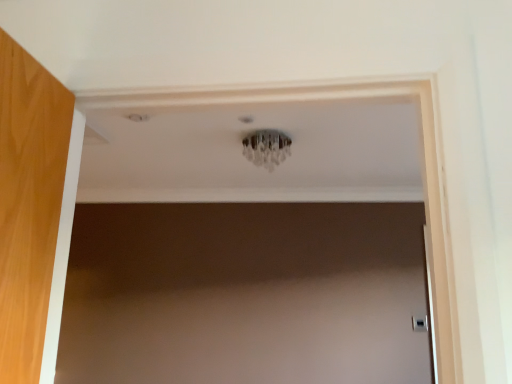
I want to click on satin silver door handle at lower right, so click(x=420, y=323).

What do you see at coordinates (420, 323) in the screenshot?
I see `satin silver door handle at lower right` at bounding box center [420, 323].

The width and height of the screenshot is (512, 384). Describe the element at coordinates (266, 148) in the screenshot. I see `clear crystal chandelier at center` at that location.

Where is `clear crystal chandelier at center`? The height and width of the screenshot is (384, 512). clear crystal chandelier at center is located at coordinates (266, 148).

Identify the location of satin silver door handle at lower right. (420, 323).

Based on their positions, is clear crystal chandelier at center located to the left or right of satin silver door handle at lower right?

From the image, it's evident that clear crystal chandelier at center is to the left of satin silver door handle at lower right.

Is the position of clear crystal chandelier at center more distant than that of satin silver door handle at lower right?

That is False.

Is point (263, 133) positioned in front of point (422, 330)?

Yes.

From the image's perspective, is clear crystal chandelier at center above or below satin silver door handle at lower right?

Clearly, from the image's perspective, clear crystal chandelier at center is above satin silver door handle at lower right.

Based on the photo, from a real-world perspective, who is located lower, clear crystal chandelier at center or satin silver door handle at lower right?

From a 3D spatial view, satin silver door handle at lower right is below.

Considering the sizes of objects clear crystal chandelier at center and satin silver door handle at lower right in the image provided, who is wider, clear crystal chandelier at center or satin silver door handle at lower right?

clear crystal chandelier at center is wider.

From their relative heights in the image, would you say clear crystal chandelier at center is taller or shorter than satin silver door handle at lower right?

Clearly, clear crystal chandelier at center is taller compared to satin silver door handle at lower right.

In the scene shown: Considering the sizes of objects clear crystal chandelier at center and satin silver door handle at lower right in the image provided, who is bigger, clear crystal chandelier at center or satin silver door handle at lower right?

clear crystal chandelier at center is bigger.

Is clear crystal chandelier at center inside the boundaries of satin silver door handle at lower right, or outside?

clear crystal chandelier at center is spatially situated outside satin silver door handle at lower right.

Are clear crystal chandelier at center and satin silver door handle at lower right far apart?

Yes, clear crystal chandelier at center and satin silver door handle at lower right are located far from each other.

Is clear crystal chandelier at center looking in the opposite direction of satin silver door handle at lower right?

No.

Where is `light fixture located in front of the satin silver door handle at lower right`? The image size is (512, 384). light fixture located in front of the satin silver door handle at lower right is located at coordinates (266, 148).

From the picture: Between satin silver door handle at lower right and clear crystal chandelier at center, which one appears on the left side from the viewer's perspective?

clear crystal chandelier at center is more to the left.

Considering the positions of objects satin silver door handle at lower right and clear crystal chandelier at center in the image provided, who is in front, satin silver door handle at lower right or clear crystal chandelier at center?

clear crystal chandelier at center is in front.

Which point is more forward, (420, 330) or (254, 148)?

The point (254, 148) is closer.

From the image's perspective, which one is positioned lower, satin silver door handle at lower right or clear crystal chandelier at center?

satin silver door handle at lower right, from the image's perspective.

From a real-world perspective, between satin silver door handle at lower right and clear crystal chandelier at center, who is vertically higher?

In real-world perspective, clear crystal chandelier at center is above.

Is satin silver door handle at lower right wider or thinner than clear crystal chandelier at center?

In the image, satin silver door handle at lower right appears to be more narrow than clear crystal chandelier at center.

From the picture: Is satin silver door handle at lower right taller than clear crystal chandelier at center?

In fact, satin silver door handle at lower right may be shorter than clear crystal chandelier at center.

Based on their sizes in the image, would you say satin silver door handle at lower right is bigger or smaller than clear crystal chandelier at center?

satin silver door handle at lower right is smaller than clear crystal chandelier at center.

Is clear crystal chandelier at center a part of satin silver door handle at lower right?

No, clear crystal chandelier at center is not surrounded by satin silver door handle at lower right.

Is satin silver door handle at lower right directly adjacent to clear crystal chandelier at center?

satin silver door handle at lower right and clear crystal chandelier at center are not in contact.

Is satin silver door handle at lower right oriented away from clear crystal chandelier at center?

No.

How different are the orientations of satin silver door handle at lower right and clear crystal chandelier at center in degrees?

satin silver door handle at lower right and clear crystal chandelier at center are facing 1.74 degrees away from each other.

This screenshot has height=384, width=512. Find the location of `light fixture above the satin silver door handle at lower right (from the image's perspective)`. light fixture above the satin silver door handle at lower right (from the image's perspective) is located at coordinates (266, 148).

You are a GUI agent. You are given a task and a screenshot of the screen. Output one action in this format:
    pyautogui.click(x=<x>, y=<y>)
    Task: Click on the door handle that appears below the clear crystal chandelier at center (from the image's perspective)
    The image size is (512, 384).
    Given the screenshot: What is the action you would take?
    pyautogui.click(x=420, y=323)

In the image, there is a satin silver door handle at lower right. At what (x,y) coordinates should I click in order to perform the action: click on light fixture above it (from the image's perspective). Please return your answer as a coordinate pair (x, y). This screenshot has width=512, height=384. Looking at the image, I should click on (266, 148).